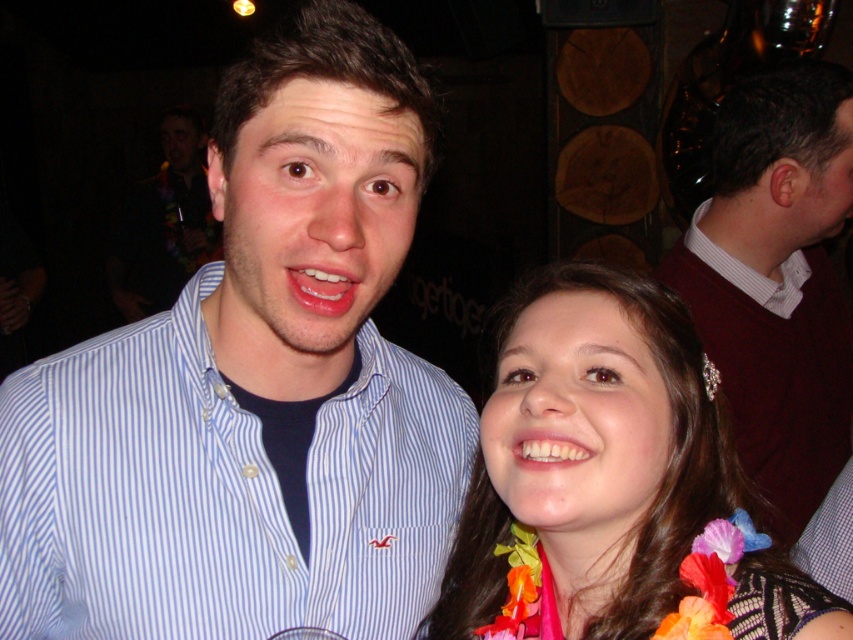
Is maroon sweater at right positioned at the back of glossy pink lips at center?

Yes.

Image resolution: width=853 pixels, height=640 pixels. What do you see at coordinates (776, 280) in the screenshot?
I see `maroon sweater at right` at bounding box center [776, 280].

Find the location of a particular element. This screenshot has width=853, height=640. maroon sweater at right is located at coordinates (776, 280).

The width and height of the screenshot is (853, 640). Find the location of `maroon sweater at right`. maroon sweater at right is located at coordinates (776, 280).

Can you confirm if floral necklace at center is positioned above white striped shirt at upper right?

Actually, floral necklace at center is below white striped shirt at upper right.

Which of these two, floral necklace at center or white striped shirt at upper right, stands taller?

floral necklace at center

Measure the distance between point (x=537, y=378) and camera.

Point (x=537, y=378) is 27.35 inches from camera.

Locate an element on the screen. The width and height of the screenshot is (853, 640). floral necklace at center is located at coordinates (614, 484).

Is point (167, 244) closer to camera compared to point (332, 292)?

That is False.

Who is taller, matte blue shirt at center or glossy pink lips at center?

With more height is matte blue shirt at center.

Identify the location of matte blue shirt at center. (163, 224).